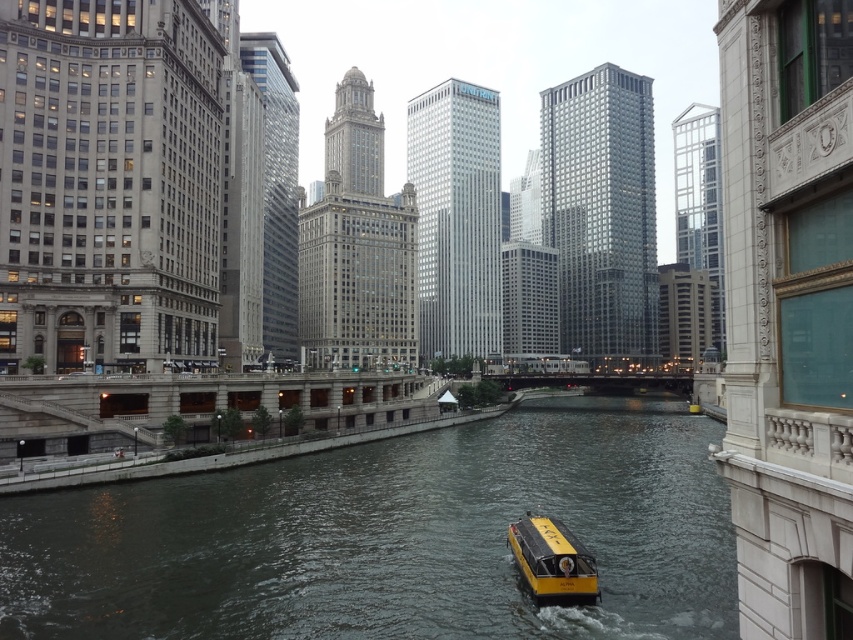
Which is behind, point (618, 508) or point (546, 525)?

Point (618, 508)

Does dark gray water at center have a greater width compared to yellow matte boat at center?

Indeed, dark gray water at center has a greater width compared to yellow matte boat at center.

Does point (230, 554) come farther from viewer compared to point (578, 572)?

Yes, point (230, 554) is farther from viewer.

The height and width of the screenshot is (640, 853). In order to click on dark gray water at center in this screenshot , I will do (x=392, y=538).